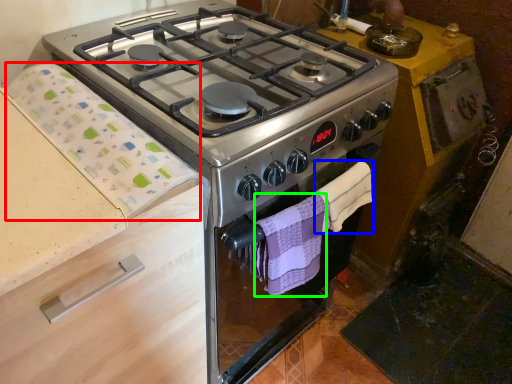
Question: Considering the real-world distances, which object is farthest from blanket (highlighted by a red box)? hand towel (highlighted by a blue box) or hand towel (highlighted by a green box)?

Choices:
 (A) hand towel
 (B) hand towel

Answer: (A)